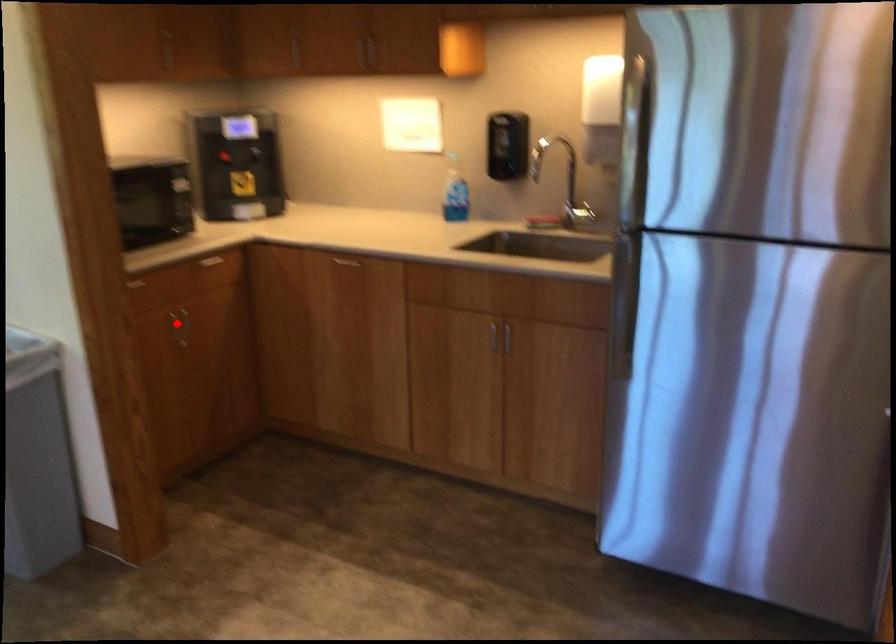
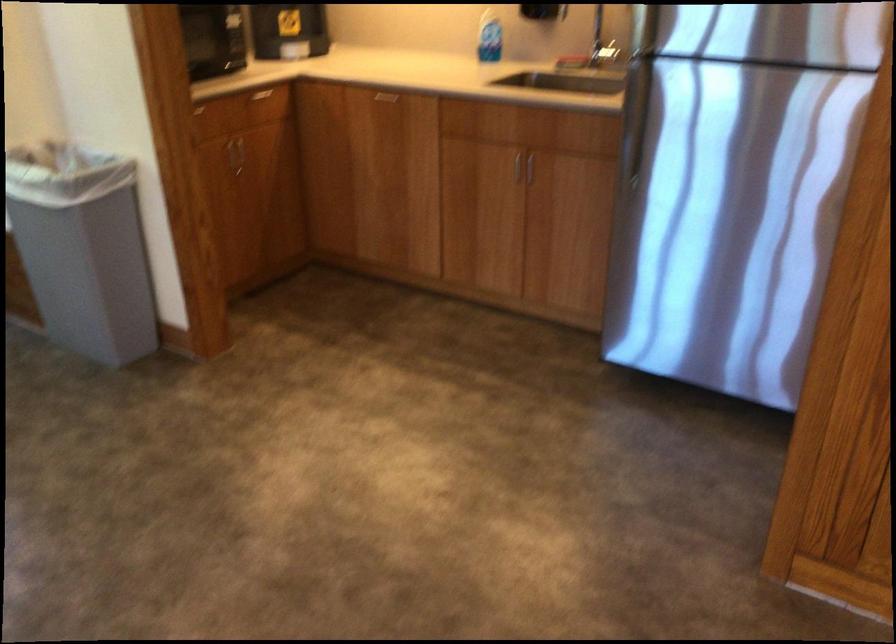
Locate, in the second image, the point that corresponds to the highlighted location in the first image.

(234, 153)